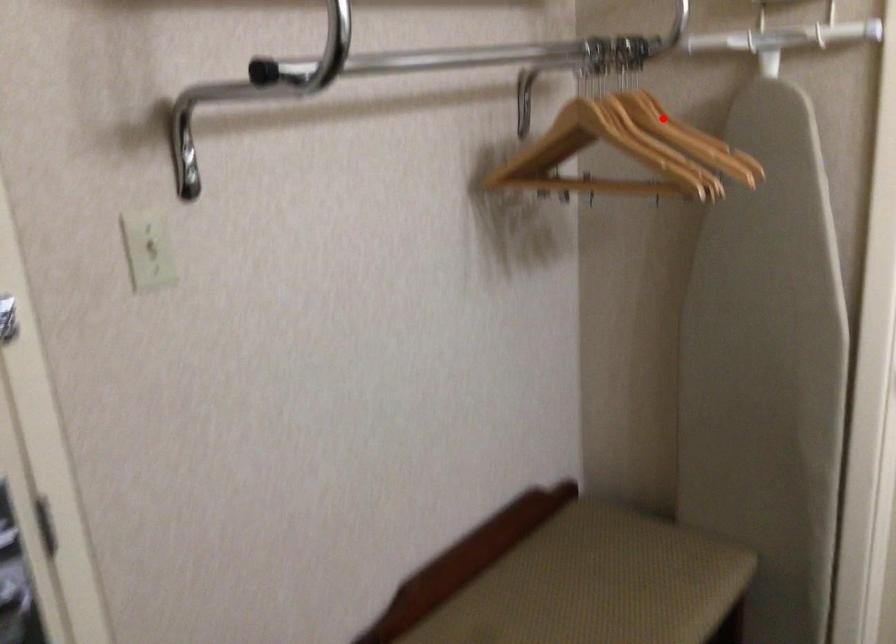
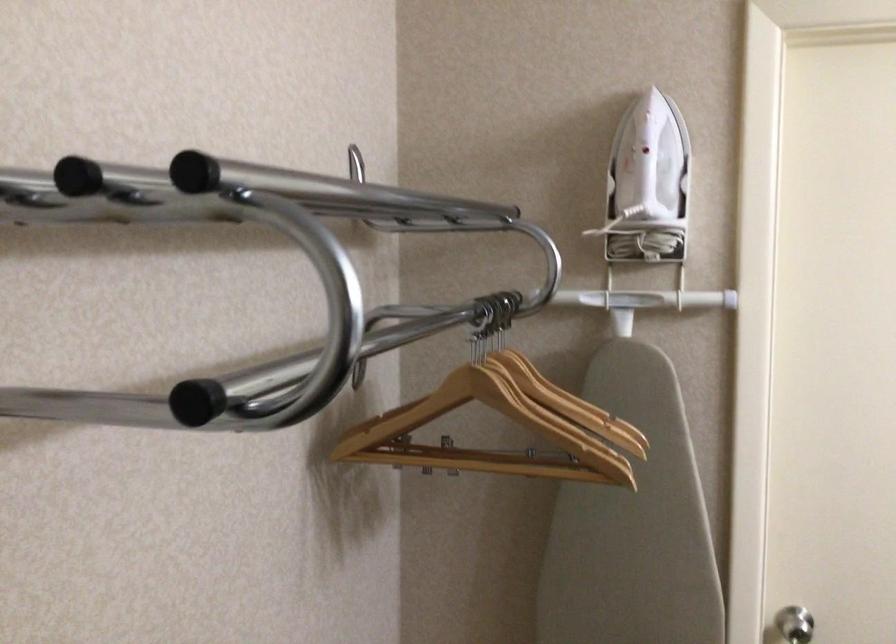
Find the pixel in the second image that matches the highlighted location in the first image.

(538, 377)